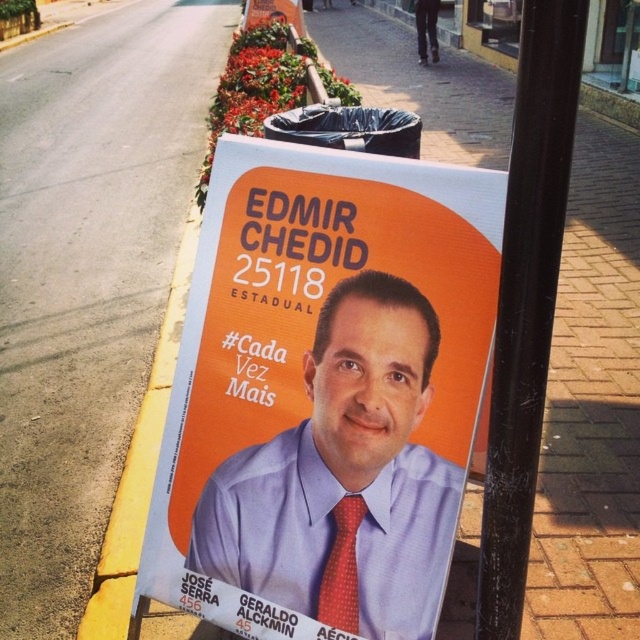
You are a graphic designer reviewing a campaign poster design. You notice the red dotted fabric tie at center and the orange matte poster at upper center. Which object is located lower in the image?

The red dotted fabric tie at center is positioned under the orange matte poster at upper center, so it is located lower in the image.

You are a photographer standing in front of the political campaign poster. You want to take a clear photo of the matte blue shirt at center without the black metal pole at center blocking it. How should you adjust your position?

The black metal pole at center is behind the matte blue shirt at center, so to avoid the pole blocking the shirt, you should position yourself so the matte blue shirt at center is between you and the black metal pole at center. This way, the shirt will obscure the pole in the photo.

Looking at the political campaign poster, there is a man wearing a matte blue shirt at center and a red dotted fabric tie at center. Which clothing item is taller?

The matte blue shirt at center is much taller than the red dotted fabric tie at center.